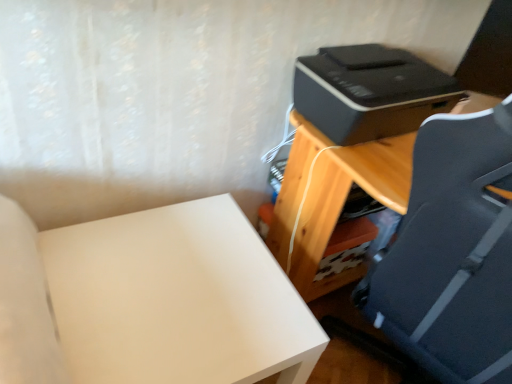
Question: From a real-world perspective, is black plastic printer at upper right physically located above or below wooden desk at right?

Choices:
 (A) above
 (B) below

Answer: (A)

Question: Is black plastic printer at upper right taller or shorter than wooden desk at right?

Choices:
 (A) short
 (B) tall

Answer: (A)

Question: Considering the real-world distances, which object is farthest from the black plastic printer at upper right?

Choices:
 (A) wooden desk at right
 (B) white matte table at lower left

Answer: (B)

Question: Based on their relative distances, which object is farther from the black plastic printer at upper right?

Choices:
 (A) wooden desk at right
 (B) white matte table at lower left

Answer: (B)